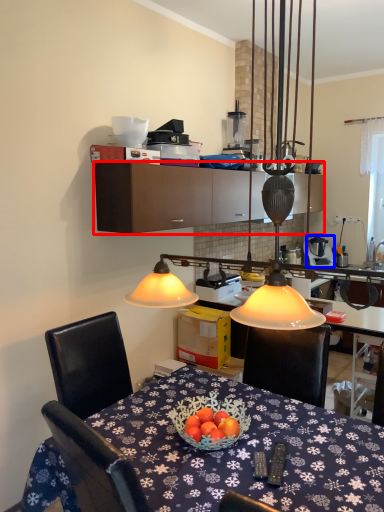
Question: Which object is closer to the camera taking this photo, cabinetry (highlighted by a red box) or appliance (highlighted by a blue box)?

Choices:
 (A) cabinetry
 (B) appliance

Answer: (A)